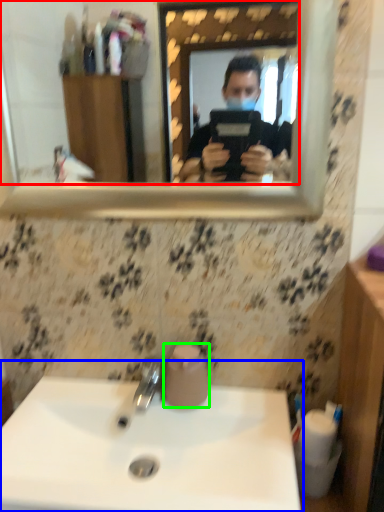
Question: Which is nearer to the mirror (highlighted by a red box)? sink (highlighted by a blue box) or toilet paper (highlighted by a green box).

Choices:
 (A) sink
 (B) toilet paper

Answer: (A)